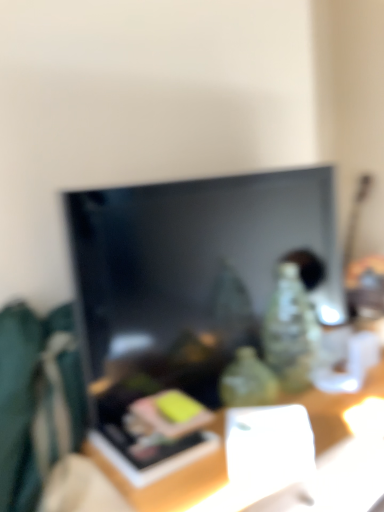
The image size is (384, 512). Describe the element at coordinates (167, 482) in the screenshot. I see `wooden table at center` at that location.

You are a GUI agent. You are given a task and a screenshot of the screen. Output one action in this format:
    pyautogui.click(x=<x>, y=<y>)
    Task: Click on the wooden table at center
    
    Given the screenshot: What is the action you would take?
    point(167,482)

Where is `black glossy tv at center`? This screenshot has height=512, width=384. black glossy tv at center is located at coordinates (192, 269).

Measure the distance between black glossy tv at center and camera.

The depth of black glossy tv at center is 1.12 meters.

Describe the element at coordinates (192, 269) in the screenshot. I see `black glossy tv at center` at that location.

At what (x,y) coordinates should I click in order to perform the action: click on wooden table at center. Please return your answer as a coordinate pair (x, y). Looking at the image, I should click on (167, 482).

Based on their positions, is black glossy tv at center located to the left or right of wooden table at center?

In the image, black glossy tv at center appears on the left side of wooden table at center.

Considering their positions, is black glossy tv at center located in front of or behind wooden table at center?

Visually, black glossy tv at center is located behind wooden table at center.

Which is behind, point (106, 267) or point (168, 485)?

The point (106, 267) is farther.

In the scene shown: From the image's perspective, is black glossy tv at center on top of wooden table at center?

Yes.

From a real-world perspective, which object rests below the other?

wooden table at center is physically lower.

Is black glossy tv at center wider than wooden table at center?

No.

Is black glossy tv at center shorter than wooden table at center?

No, black glossy tv at center is not shorter than wooden table at center.

Is black glossy tv at center smaller than wooden table at center?

Indeed, black glossy tv at center has a smaller size compared to wooden table at center.

Is black glossy tv at center surrounding wooden table at center?

That's incorrect, wooden table at center is not inside black glossy tv at center.

Is black glossy tv at center next to wooden table at center?

black glossy tv at center and wooden table at center are not in contact.

Is black glossy tv at center facing away from wooden table at center?

No, wooden table at center is not at the back of black glossy tv at center.

The image size is (384, 512). What are the coordinates of `television to the left of wooden table at center` in the screenshot? It's located at (192, 269).

Is wooden table at center at the right side of black glossy tv at center?

Yes, wooden table at center is to the right of black glossy tv at center.

Which object is more forward, wooden table at center or black glossy tv at center?

wooden table at center is closer to the camera.

Considering the points (204, 463) and (312, 242), which point is behind, point (204, 463) or point (312, 242)?

Positioned behind is point (312, 242).

From the image's perspective, would you say wooden table at center is positioned over black glossy tv at center?

Incorrect, from the image's perspective, wooden table at center is lower than black glossy tv at center.

From a real-world perspective, is wooden table at center positioned above or below black glossy tv at center?

In terms of real-world spatial position, wooden table at center is below black glossy tv at center.

Can you confirm if wooden table at center is wider than black glossy tv at center?

Yes.

Between wooden table at center and black glossy tv at center, which one has more height?

With more height is black glossy tv at center.

Can you confirm if wooden table at center is bigger than black glossy tv at center?

Correct, wooden table at center is larger in size than black glossy tv at center.

Do you think wooden table at center is within black glossy tv at center, or outside of it?

wooden table at center cannot be found inside black glossy tv at center.

Does wooden table at center touch black glossy tv at center?

No, wooden table at center is not beside black glossy tv at center.

Is black glossy tv at center at the back of wooden table at center?

No, wooden table at center's orientation is not away from black glossy tv at center.

Can you tell me how much wooden table at center and black glossy tv at center differ in facing direction?

They differ by 2.17 degrees in their facing directions.

How much distance is there between wooden table at center and black glossy tv at center?

wooden table at center is 18.78 inches away from black glossy tv at center.

Identify the location of table in front of the black glossy tv at center. The width and height of the screenshot is (384, 512). (167, 482).

Where is `table below the black glossy tv at center (from a real-world perspective)`? table below the black glossy tv at center (from a real-world perspective) is located at coordinates (167, 482).

I want to click on table in front of the black glossy tv at center, so click(167, 482).